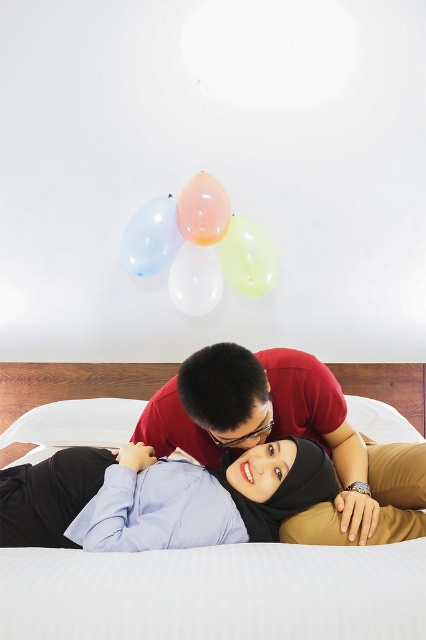
You are taking a photo of the scene and want to ensure both the matte red shirt at center and the translucent rubber balloon at upper center are in focus. Which object should you focus on first to ensure the other is also in focus?

The matte red shirt at center is located below the translucent rubber balloon at upper center. To ensure both are in focus, you should focus on the translucent rubber balloon at upper center since it is farther away, allowing the depth of field to include the closer matte red shirt at center.

Looking at the scene with the two people on the bed, you notice a white soft pillow at center and a translucent white balloon at upper center. Which object is positioned higher up in the image?

The translucent white balloon at upper center is positioned higher up in the image than the white soft pillow at center.